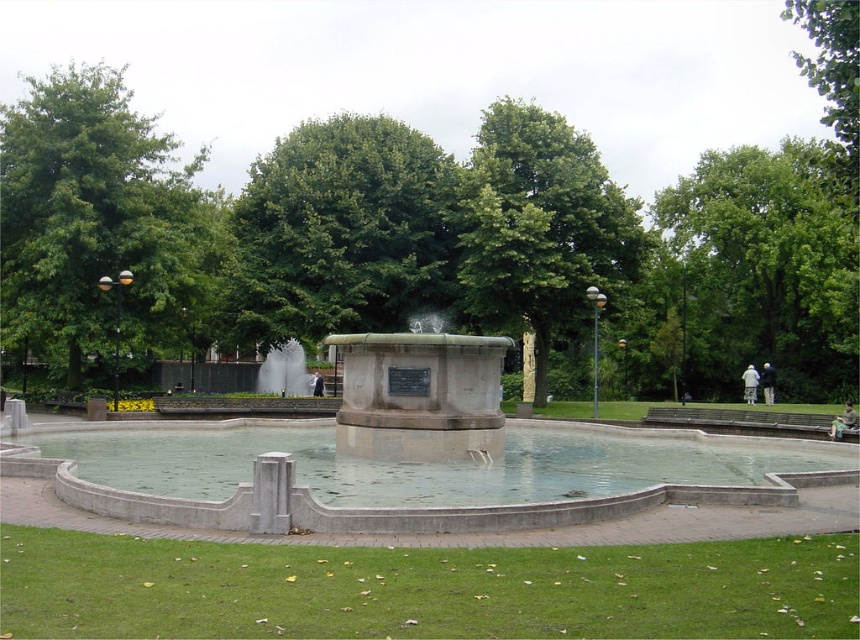
You are standing in the park and want to take a photo of both the green leafy tree at upper center and the green leafy tree at upper right. Which tree should you move closer to in order to get both trees in the same frame?

You should move closer to the green leafy tree at upper right because it is farther away from you than the green leafy tree at upper center. By moving closer to the farther tree, you can better frame both trees within the camera view.

You are standing at the center of the park and want to locate the green leafy tree at upper center. According to the coordinates provided, in which direction should you look to find it?

The green leafy tree at upper center is located at coordinates point (x=539, y=227), which is slightly to the left and above your current position at the center. You should look to your upper left direction to find it.

Based on the photo, you are standing in the park and want to take a photo of the fountain. A photographer advises you to position yourself exactly at point (15, 346) to capture the best angle. However, you are currently 30 meters away from the fountain. Should you move closer or farther away to reach the recommended point?

The distance of point (15, 346) from viewer is 32.57 meters. Since you are currently 30 meters away from the fountain, you need to move farther away to reach the recommended point at 32.57 meters.